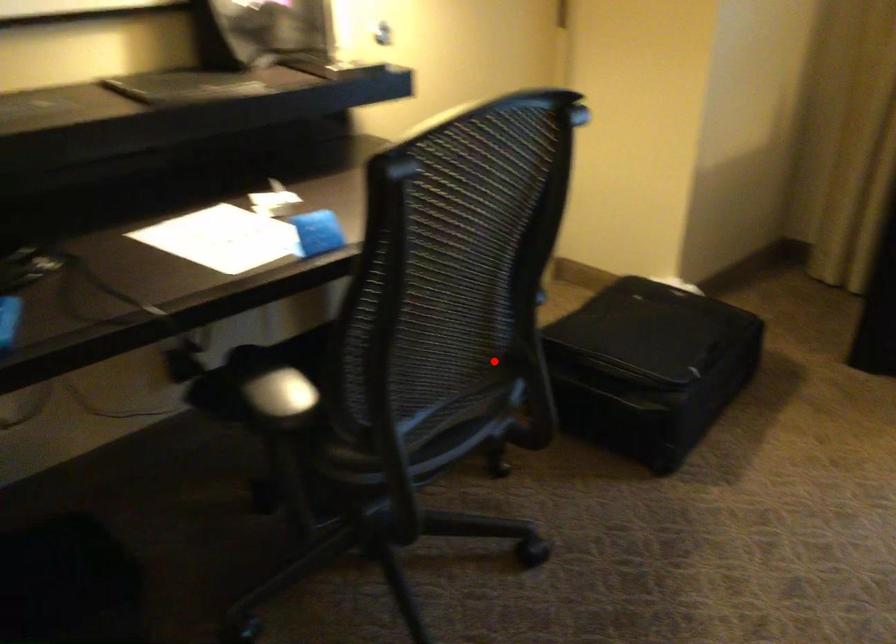
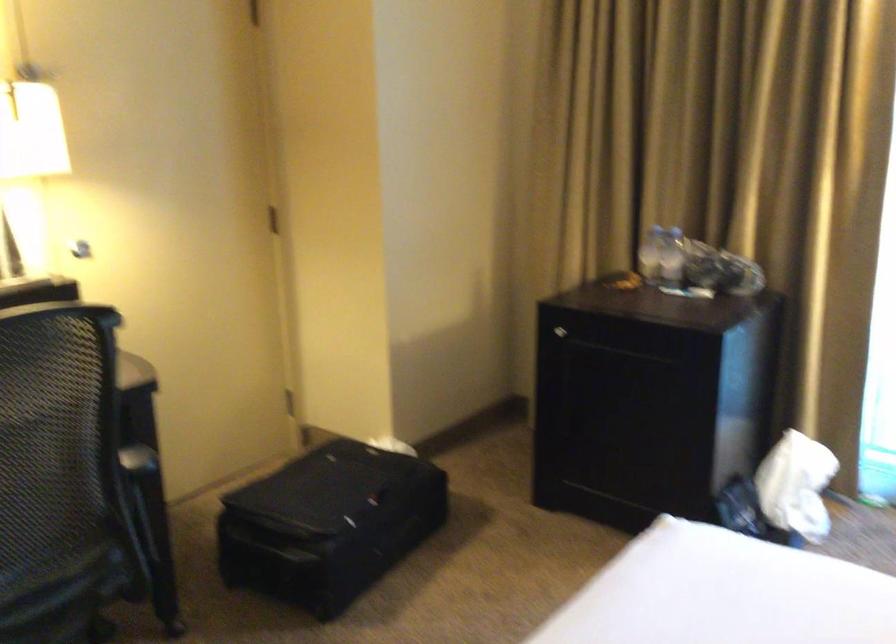
Question: I am providing you with two images of the same scene from different viewpoints. In image1, a red point is highlighted. Considering the same 3D point in image2, which of the following is correct?

Choices:
 (A) It is closer
 (B) It is farther

Answer: (B)